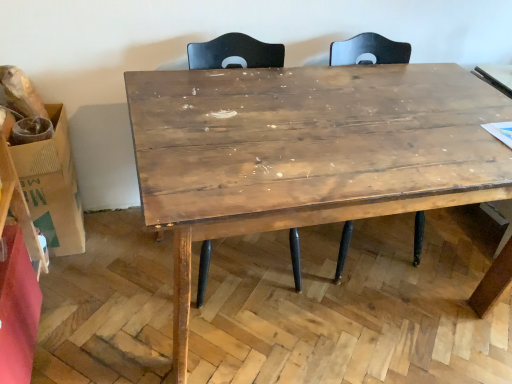
In order to click on vacant space that is in between wooden table at center and brown cardboard box at left in this screenshot , I will do `click(110, 281)`.